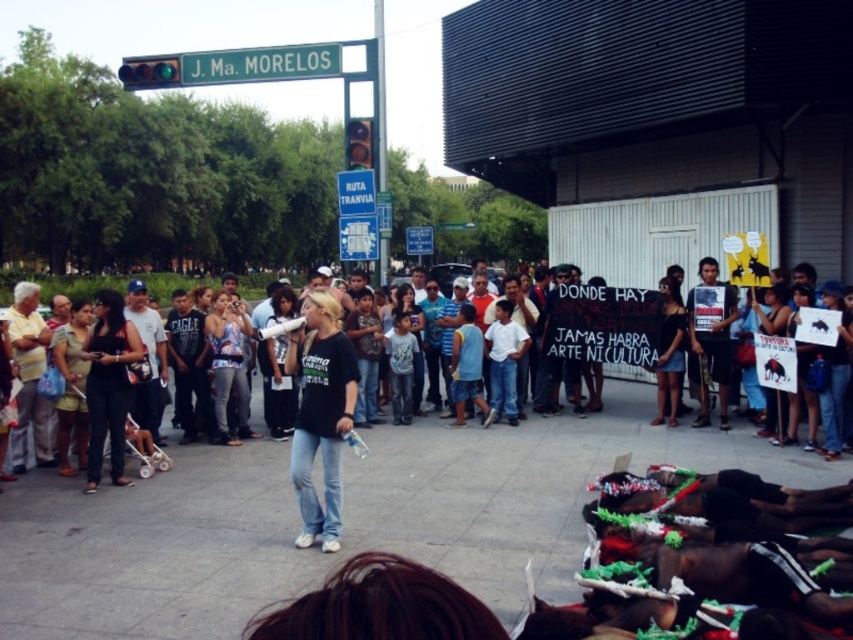
Question: Can you confirm if black matte shirt at center is bigger than black fabric shirt at center?

Choices:
 (A) no
 (B) yes

Answer: (B)

Question: Where is black matte shirt at center located in relation to black fabric shirt at center in the image?

Choices:
 (A) left
 (B) right

Answer: (B)

Question: Among these points, which one is nearest to the camera?

Choices:
 (A) (126, 480)
 (B) (370, 141)
 (C) (323, 324)

Answer: (C)

Question: Can you confirm if black matte shirt at center is positioned to the right of black fabric shirt at center?

Choices:
 (A) no
 (B) yes

Answer: (B)

Question: Which object appears closest to the camera in this image?

Choices:
 (A) black matte shirt at center
 (B) green metallic street sign at upper left

Answer: (A)

Question: Estimate the real-world distances between objects in this image. Which object is closer to the black matte shirt at center?

Choices:
 (A) black fabric shirt at center
 (B) green metallic street sign at upper left

Answer: (A)